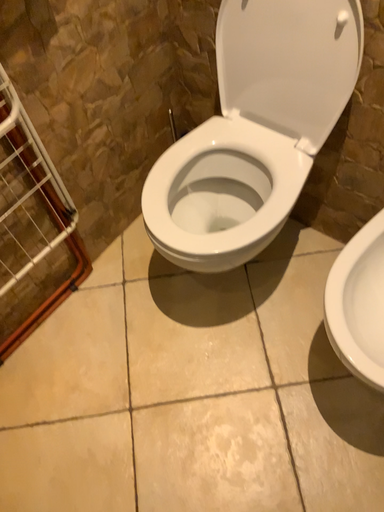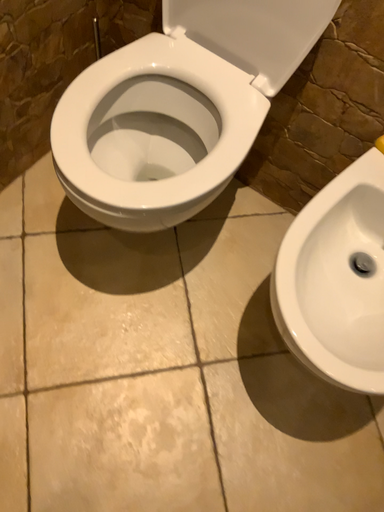
Question: Which way did the camera rotate in the video?

Choices:
 (A) rotated downward
 (B) rotated upward

Answer: (A)